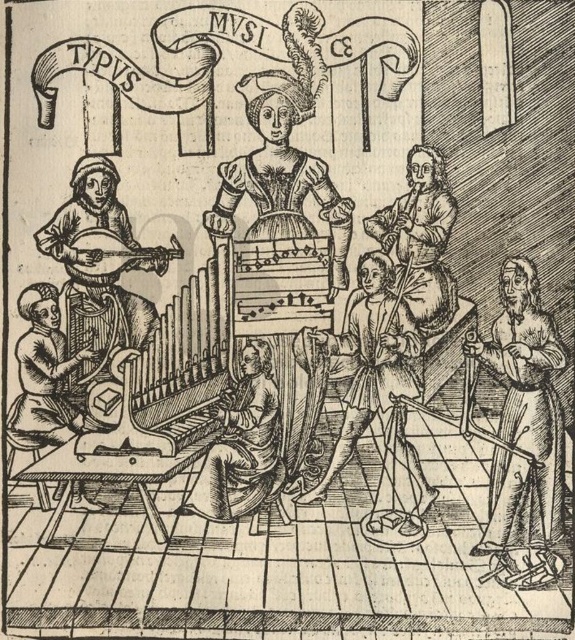
Identify the location of matte black organ at center. This screenshot has height=640, width=575. point(281,172).

Does matte black organ at center have a lesser width compared to wooden harp at lower left?

In fact, matte black organ at center might be wider than wooden harp at lower left.

Is point (322, 161) positioned behind point (39, 298)?

Yes.

Locate an element on the screen. This screenshot has height=640, width=575. matte black organ at center is located at coordinates (281, 172).

Between smooth wood person at center and wooden lute at left, which one appears on the right side from the viewer's perspective?

From the viewer's perspective, smooth wood person at center appears more on the right side.

Does point (270, 444) come closer to viewer compared to point (143, 250)?

That is True.

Where is `smooth wood person at center`? smooth wood person at center is located at coordinates (243, 444).

Does wooden harp at lower left have a larger size compared to wooden lute at left?

Yes, wooden harp at lower left is bigger than wooden lute at left.

Who is positioned more to the right, wooden harp at lower left or wooden lute at left?

From the viewer's perspective, wooden lute at left appears more on the right side.

The image size is (575, 640). I want to click on wooden harp at lower left, so click(43, 376).